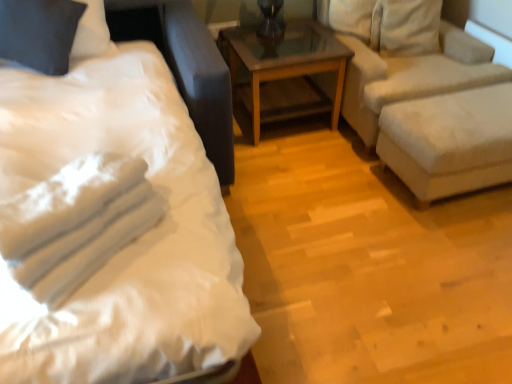
Question: Can you confirm if white fabric ottoman at right is wider than brown wooden table at center?

Choices:
 (A) no
 (B) yes

Answer: (A)

Question: Can you confirm if white fabric ottoman at right is positioned to the left of brown wooden table at center?

Choices:
 (A) no
 (B) yes

Answer: (A)

Question: Is brown wooden table at center at the back of white fabric ottoman at right?

Choices:
 (A) yes
 (B) no

Answer: (A)

Question: Does white fabric ottoman at right have a smaller size compared to brown wooden table at center?

Choices:
 (A) no
 (B) yes

Answer: (B)

Question: Are white fabric ottoman at right and brown wooden table at center far apart?

Choices:
 (A) no
 (B) yes

Answer: (A)

Question: From the image's perspective, is white fabric ottoman at right on brown wooden table at center?

Choices:
 (A) no
 (B) yes

Answer: (A)

Question: From the image's perspective, is white satin bed at left above white cotton towels at left?

Choices:
 (A) yes
 (B) no

Answer: (A)

Question: Can you confirm if white satin bed at left is wider than white cotton towels at left?

Choices:
 (A) yes
 (B) no

Answer: (A)

Question: From the image's perspective, is white satin bed at left under white cotton towels at left?

Choices:
 (A) no
 (B) yes

Answer: (A)

Question: Is white satin bed at left not within white cotton towels at left?

Choices:
 (A) no
 (B) yes

Answer: (B)

Question: Does white satin bed at left have a larger size compared to white cotton towels at left?

Choices:
 (A) yes
 (B) no

Answer: (A)

Question: Could you tell me if white satin bed at left is turned towards white cotton towels at left?

Choices:
 (A) yes
 (B) no

Answer: (B)

Question: Is white fabric ottoman at right at the back of dark gray fabric pillow at upper left?

Choices:
 (A) no
 (B) yes

Answer: (A)